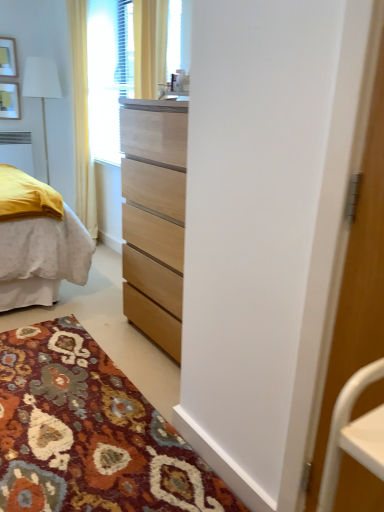
Question: From the image's perspective, is yellow fabric curtain at upper left located above or below wooden picture frame at upper left, the first picture frame when ordered from bottom to top?

Choices:
 (A) below
 (B) above

Answer: (A)

Question: Looking at the image, does yellow fabric curtain at upper left seem bigger or smaller compared to wooden picture frame at upper left, the first picture frame when ordered from bottom to top?

Choices:
 (A) big
 (B) small

Answer: (A)

Question: Based on their relative distances, which object is farther from the yellow fabric curtain at upper left?

Choices:
 (A) white fabric lampshade at left
 (B) wooden picture frame at upper left, the first picture frame when ordered from bottom to top
 (C) matte white picture frame at upper left, the 2th picture frame positioned from the bottom
 (D) white plastic radiator at left
 (E) white glossy screen door at right

Answer: (E)

Question: Estimate the real-world distances between objects in this image. Which object is closer to the matte white picture frame at upper left, which ranks as the first picture frame in top-to-bottom order?

Choices:
 (A) yellow fabric curtain at upper left
 (B) white fabric lampshade at left
 (C) white plastic radiator at left
 (D) white glossy screen door at right
 (E) wooden picture frame at upper left, placed as the 2th picture frame when sorted from top to bottom

Answer: (E)